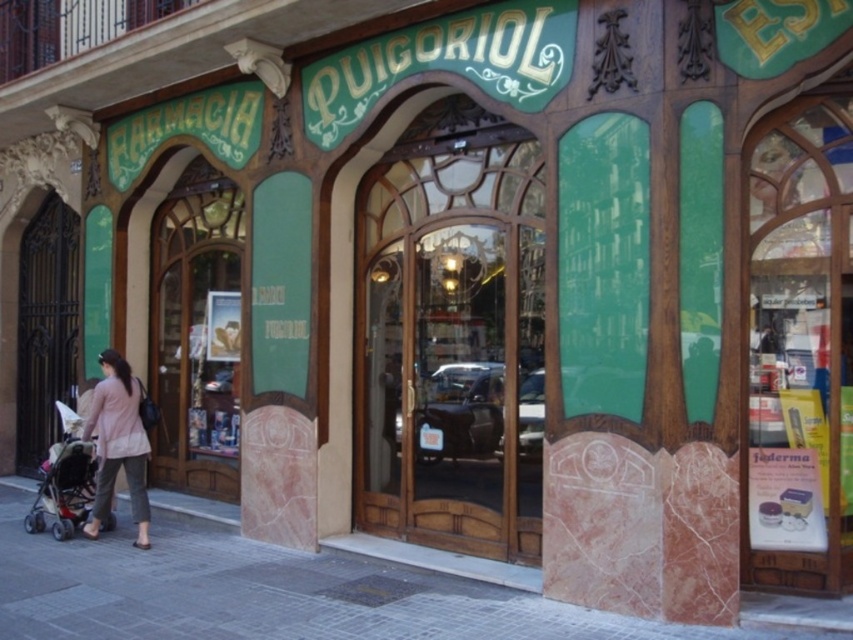
Who is higher up, wooden glass door at center or pink fabric at lower left?

Positioned higher is wooden glass door at center.

What do you see at coordinates (456, 336) in the screenshot? Image resolution: width=853 pixels, height=640 pixels. I see `wooden glass door at center` at bounding box center [456, 336].

Who is more distant from viewer, (497,365) or (135,456)?

The point (135,456) is behind.

The image size is (853, 640). I want to click on wooden glass door at center, so click(456, 336).

Does paved stone sidewalk at lower center appear under matte black stroller at lower left?

Correct, paved stone sidewalk at lower center is located below matte black stroller at lower left.

Locate an element on the screen. Image resolution: width=853 pixels, height=640 pixels. paved stone sidewalk at lower center is located at coordinates (279, 593).

What are the coordinates of `paved stone sidewalk at lower center` in the screenshot? It's located at coord(279,593).

Is paved stone sidewalk at lower center to the left of pink fabric at lower left from the viewer's perspective?

In fact, paved stone sidewalk at lower center is to the right of pink fabric at lower left.

Does paved stone sidewalk at lower center have a lesser height compared to pink fabric at lower left?

Indeed, paved stone sidewalk at lower center has a lesser height compared to pink fabric at lower left.

Who is more distant from viewer, (469, 628) or (125, 436)?

Point (125, 436)

This screenshot has width=853, height=640. What are the coordinates of `paved stone sidewalk at lower center` in the screenshot? It's located at (279, 593).